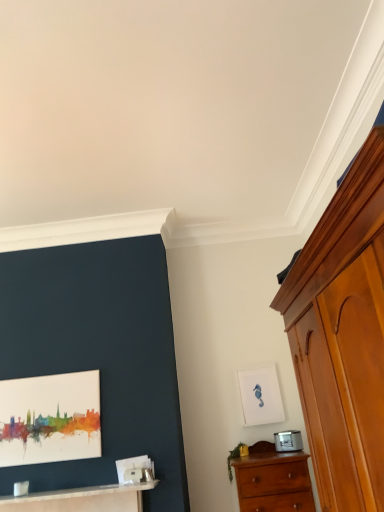
Question: Is white matte picture frame at upper right, the 2th picture frame from the front, behind wooden chest of drawers at right, the second chest of drawers when ordered from back to front?

Choices:
 (A) yes
 (B) no

Answer: (A)

Question: Does white matte picture frame at upper right, the 2th picture frame from the front, turn towards wooden chest of drawers at right, positioned as the 1th chest of drawers in top-to-bottom order?

Choices:
 (A) yes
 (B) no

Answer: (A)

Question: Is white matte picture frame at upper right, which ranks as the second picture frame in left-to-right order, wider than wooden chest of drawers at right, the first chest of drawers positioned from the front?

Choices:
 (A) yes
 (B) no

Answer: (B)

Question: Considering the relative positions of white matte picture frame at upper right, which ranks as the second picture frame in left-to-right order, and wooden chest of drawers at right, placed as the 2th chest of drawers when sorted from bottom to top, in the image provided, is white matte picture frame at upper right, which ranks as the second picture frame in left-to-right order, to the left of wooden chest of drawers at right, placed as the 2th chest of drawers when sorted from bottom to top, from the viewer's perspective?

Choices:
 (A) yes
 (B) no

Answer: (A)

Question: From the image's perspective, is white matte picture frame at upper right, the 2th picture frame from the front, above wooden chest of drawers at right, the first chest of drawers positioned from the front?

Choices:
 (A) yes
 (B) no

Answer: (B)

Question: Does white matte picture frame at upper right, which is counted as the first picture frame, starting from the back, have a lesser width compared to wooden chest of drawers at right, the second chest of drawers when ordered from back to front?

Choices:
 (A) no
 (B) yes

Answer: (B)

Question: Considering the relative positions of wooden chest of drawers at right, positioned as the 1th chest of drawers in top-to-bottom order, and white glossy table at lower left in the image provided, is wooden chest of drawers at right, positioned as the 1th chest of drawers in top-to-bottom order, to the left of white glossy table at lower left from the viewer's perspective?

Choices:
 (A) yes
 (B) no

Answer: (B)

Question: Can you confirm if wooden chest of drawers at right, the second chest of drawers when ordered from back to front, is shorter than white glossy table at lower left?

Choices:
 (A) no
 (B) yes

Answer: (A)

Question: Is wooden chest of drawers at right, placed as the 2th chest of drawers when sorted from bottom to top, wider than white glossy table at lower left?

Choices:
 (A) no
 (B) yes

Answer: (B)

Question: Considering the relative positions of wooden chest of drawers at right, the second chest of drawers when ordered from back to front, and white glossy table at lower left in the image provided, is wooden chest of drawers at right, the second chest of drawers when ordered from back to front, to the right of white glossy table at lower left from the viewer's perspective?

Choices:
 (A) no
 (B) yes

Answer: (B)

Question: From a real-world perspective, is wooden chest of drawers at right, the second chest of drawers when ordered from back to front, located higher than white glossy table at lower left?

Choices:
 (A) yes
 (B) no

Answer: (A)

Question: Is wooden chest of drawers at lower right, marked as the 2th chest of drawers in a front-to-back arrangement, positioned with its back to white glossy table at lower left?

Choices:
 (A) no
 (B) yes

Answer: (A)